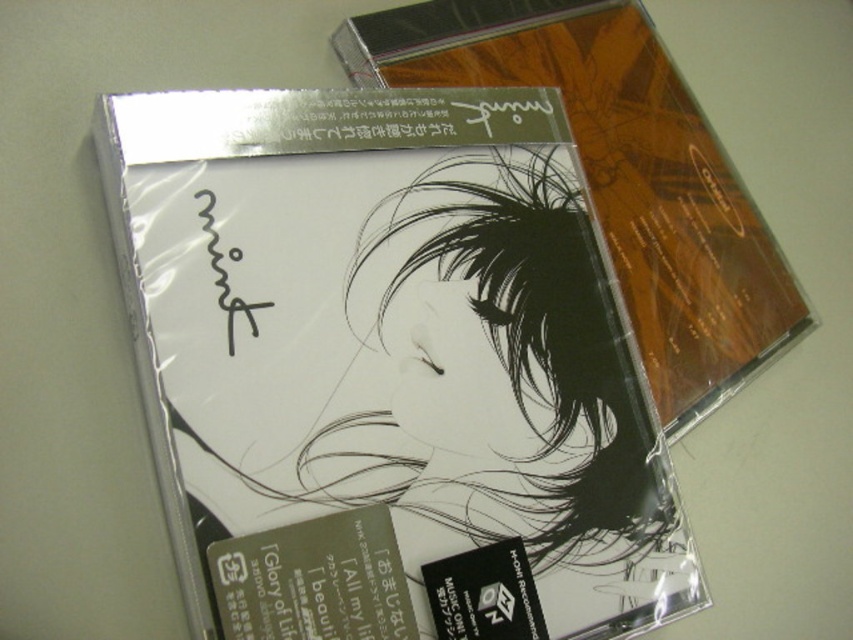
You are organizing a music collection and see the white paper at center and the matte plastic cd case at center on the table. Which object is positioned to the left side?

The white paper at center is to the left of the matte plastic cd case at center.

You are organizing a CD collection and see the white paper at center and the matte plastic cd case at center on the table. Which item is positioned lower on the table?

The white paper at center is positioned lower on the table because it is below the matte plastic cd case at center.